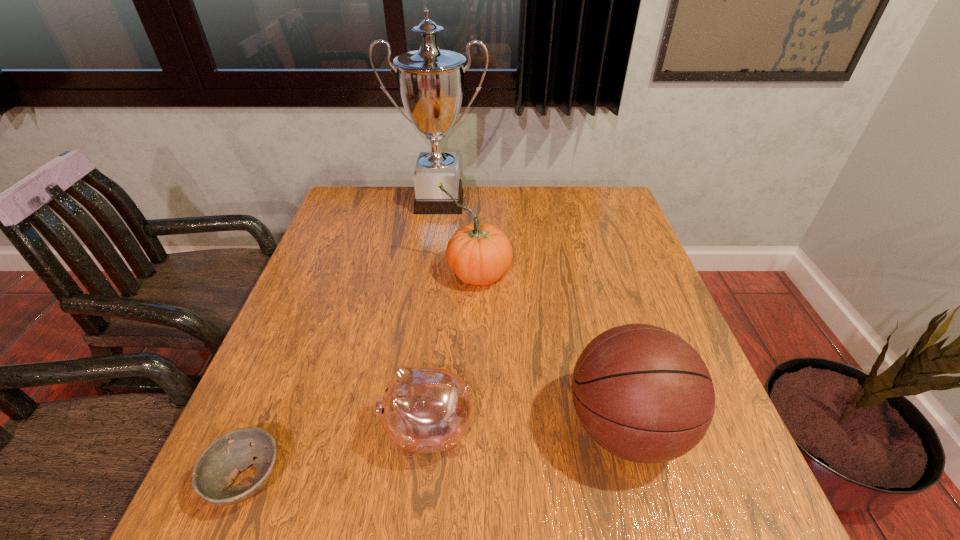
Where is `the farthest object`? This screenshot has width=960, height=540. the farthest object is located at coordinates (431, 81).

Image resolution: width=960 pixels, height=540 pixels. Find the location of `the tallest object`. the tallest object is located at coordinates (431, 81).

This screenshot has width=960, height=540. In order to click on pumpkin in this screenshot , I will do `click(479, 253)`.

The image size is (960, 540). What are the coordinates of `basketball` in the screenshot? It's located at (644, 394).

Locate an element on the screen. Image resolution: width=960 pixels, height=540 pixels. piggy bank is located at coordinates (426, 410).

Where is `bowl`? bowl is located at coordinates (219, 465).

I want to click on the leftmost object, so click(x=219, y=465).

Where is `vacant area situated at the front view of the farthest object`? The height and width of the screenshot is (540, 960). vacant area situated at the front view of the farthest object is located at coordinates (435, 233).

At what (x,y) coordinates should I click in order to perform the action: click on vacant region located 0.360m on the left of the fourth nearest object. Please return your answer as a coordinate pair (x, y). The image size is (960, 540). Looking at the image, I should click on (307, 273).

This screenshot has width=960, height=540. Find the location of `free location located on the back of the rightmost object`. free location located on the back of the rightmost object is located at coordinates (584, 274).